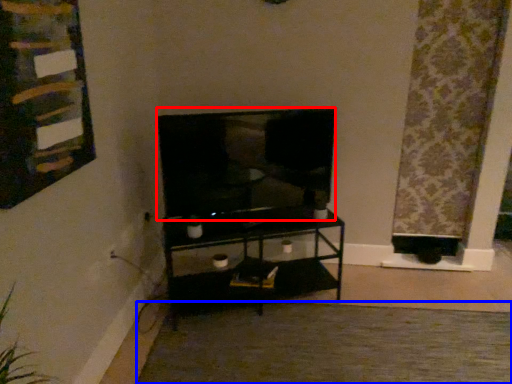
Question: Among these objects, which one is farthest to the camera, television (highlighted by a red box) or plain (highlighted by a blue box)?

Choices:
 (A) television
 (B) plain

Answer: (A)